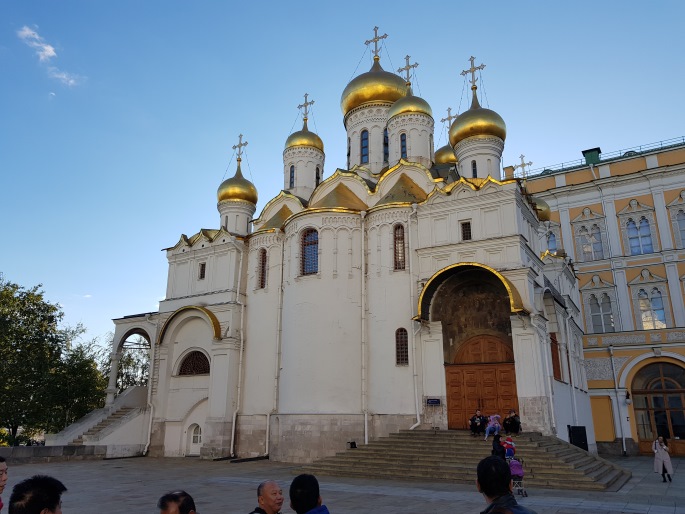
Where is `arch`? The width and height of the screenshot is (685, 514). arch is located at coordinates (472, 279), (662, 350), (125, 331), (198, 318).